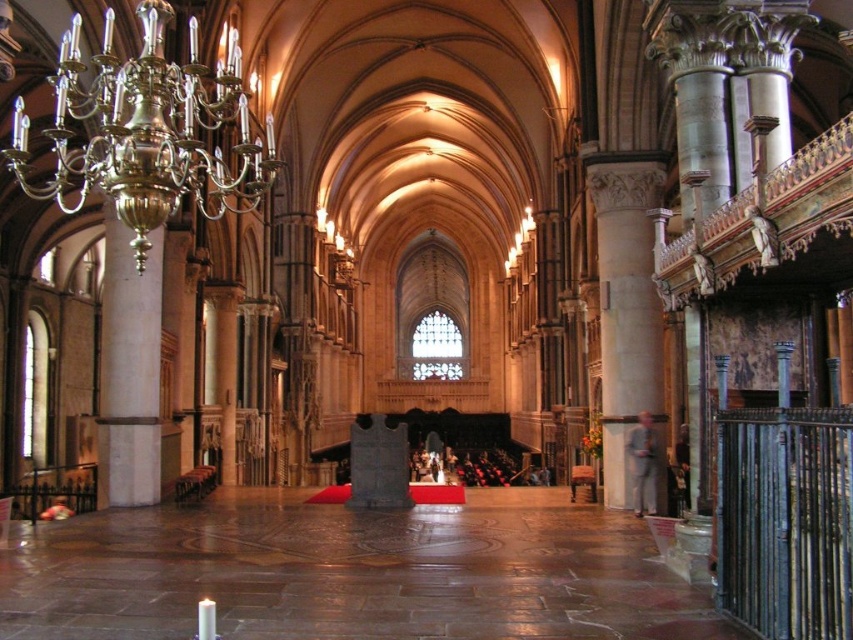
Question: Does gold polished chandelier at upper left have a larger size compared to polished stone pillar at left?

Choices:
 (A) yes
 (B) no

Answer: (B)

Question: Which object is closer to the camera taking this photo?

Choices:
 (A) white wax candle at lower left
 (B) polished stone pillar at left

Answer: (A)

Question: Estimate the real-world distances between objects in this image. Which object is farther from the gold polished chandelier at upper left?

Choices:
 (A) white wax candle at lower left
 (B) polished stone pillar at left

Answer: (A)

Question: In this image, where is gold polished chandelier at upper left located relative to polished stone pillar at left?

Choices:
 (A) left
 (B) right

Answer: (B)

Question: Where is white stone column at right located in relation to white wax candle at lower left in the image?

Choices:
 (A) above
 (B) below

Answer: (A)

Question: Among these points, which one is farthest from the camera?

Choices:
 (A) (202, 208)
 (B) (637, 198)
 (C) (103, 404)

Answer: (B)